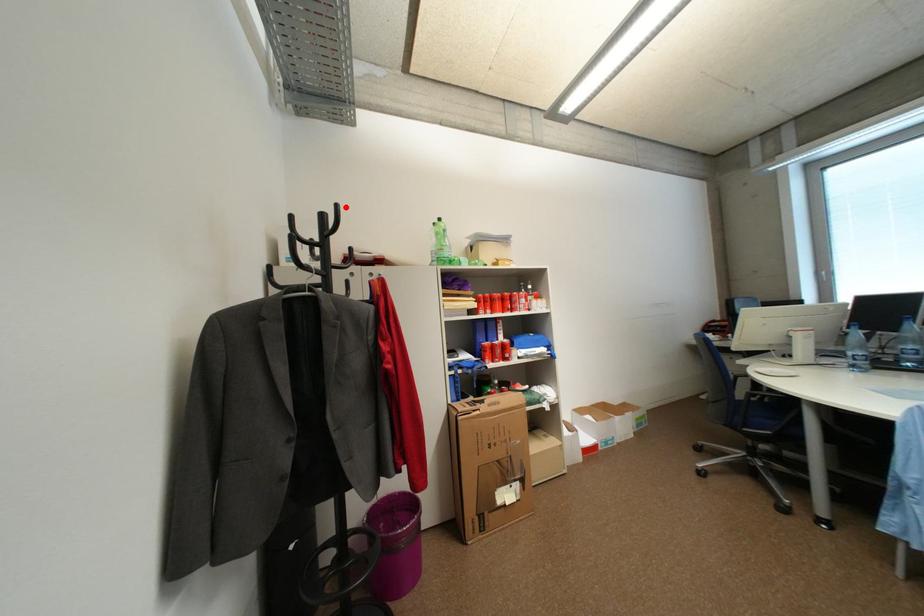
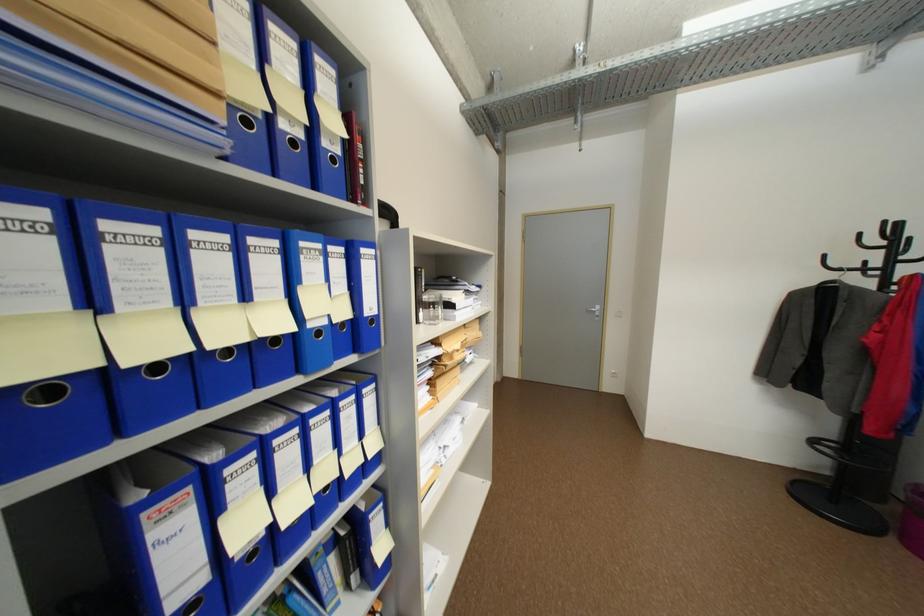
The point at the highlighted location is marked in the first image. Where is the corresponding point in the second image?

(893, 224)